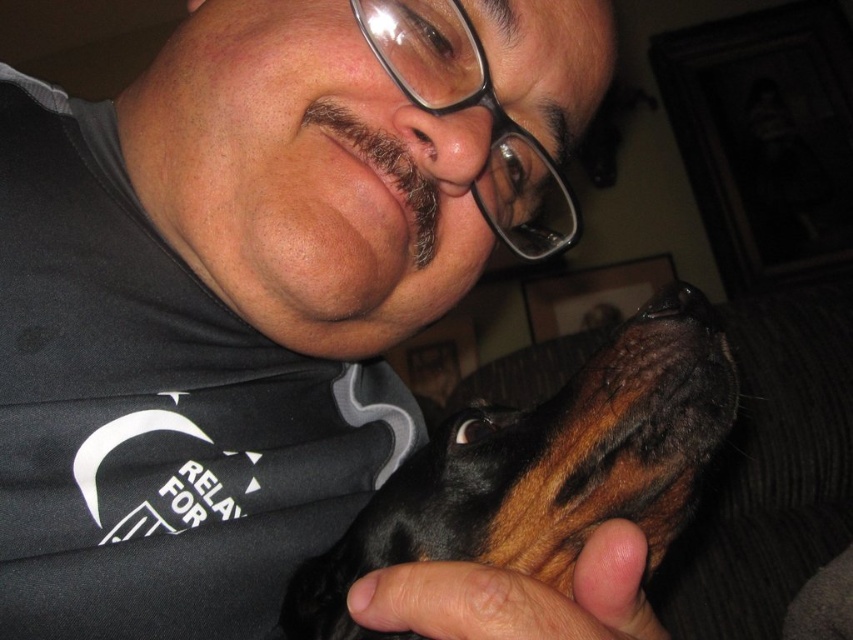
The man is wearing a black matte shirt at center and has a black shiny dog at center. Which item is larger in size?

The black matte shirt at center is bigger than the black shiny dog at center.

You are a tailor measuring the distance between the black matte shirt at center and the black shiny dog at center for a custom fitting. Can you fit a 6 inch ruler between them?

The distance between the black matte shirt at center and the black shiny dog at center is 5.65 inches, so a 6 inch ruler can fit between them since it is slightly longer than the gap.

You are a photographer trying to capture the interaction between the black matte shirt at center and the black shiny dog at center. From which side of the dog should you position the camera to ensure the shirt is visible in the shot?

The black matte shirt at center is positioned on the left side of black shiny dog at center, so positioning the camera to the left side of the dog would ensure the shirt is visible in the shot.